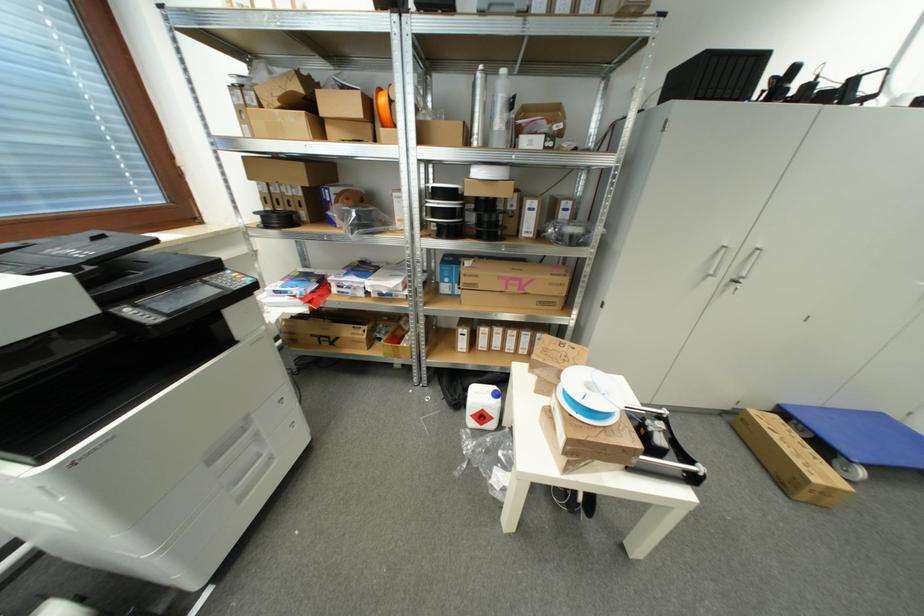
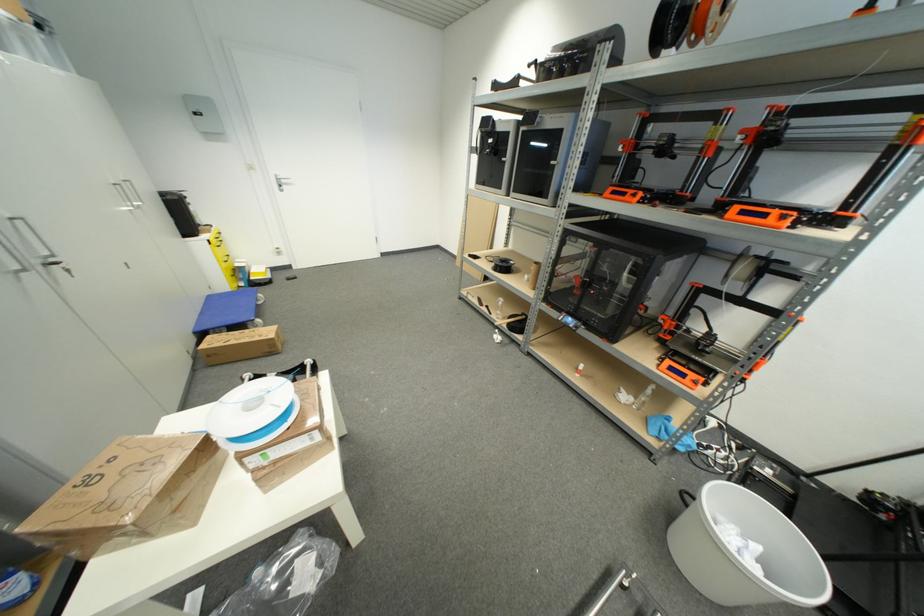
The point at (740, 284) is marked in the first image. Where is the corresponding point in the second image?

(59, 265)